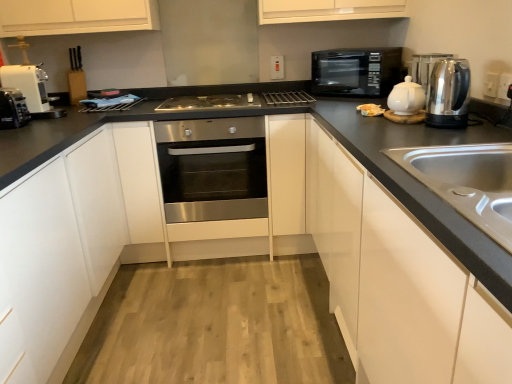
Locate an element on the screen. The height and width of the screenshot is (384, 512). unoccupied region to the right of white plastic toaster at left is located at coordinates (54, 125).